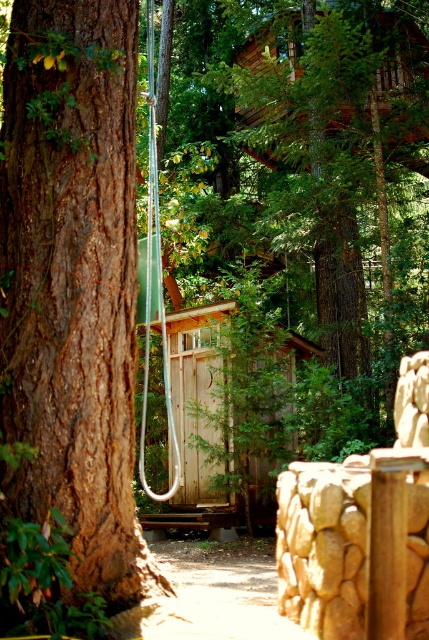
You are an explorer in the forest and need to find shelter. You see a smooth brown tree trunk at center and a weathered wood cabin at center. Which object is closer to you?

The smooth brown tree trunk at center is closer because it is positioned over the weathered wood cabin at center, indicating it is in a more forward plane.

You are a hiker who wants to take a photo of the weathered wood cabin at center without the brown rough bark tree at left blocking the view. Is there a way to do this by moving to the right side of the scene?

The brown rough bark tree at left is positioned over the weathered wood cabin at center, so moving to the right side of the scene would allow you to take a photo of the weathered wood cabin at center without the tree blocking the view.

Looking at this image, you are an explorer trying to determine the best path through the forest. You notice a smooth brown tree trunk at center and a weathered wood cabin at center. Which object has a smaller diameter?

The smooth brown tree trunk at center has a smaller diameter than the weathered wood cabin at center.